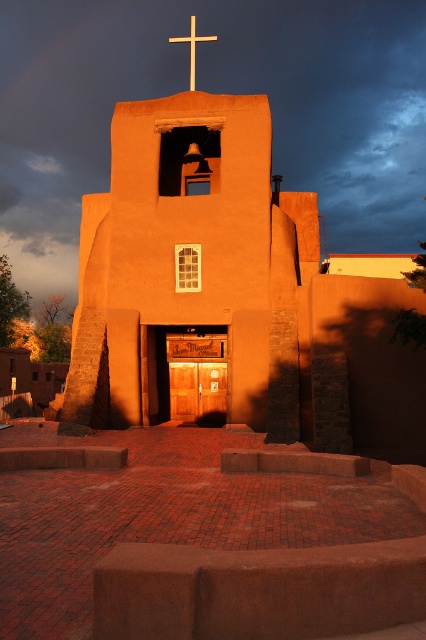
Who is shorter, adobe stucco chapel at center or wooden cross at upper center?

adobe stucco chapel at center

From the picture: Is adobe stucco chapel at center closer to the viewer compared to wooden cross at upper center?

Yes.

Is point (321, 317) positioned in front of point (193, 32)?

Yes, point (321, 317) is closer to viewer.

Locate an element on the screen. This screenshot has height=640, width=426. adobe stucco chapel at center is located at coordinates (227, 294).